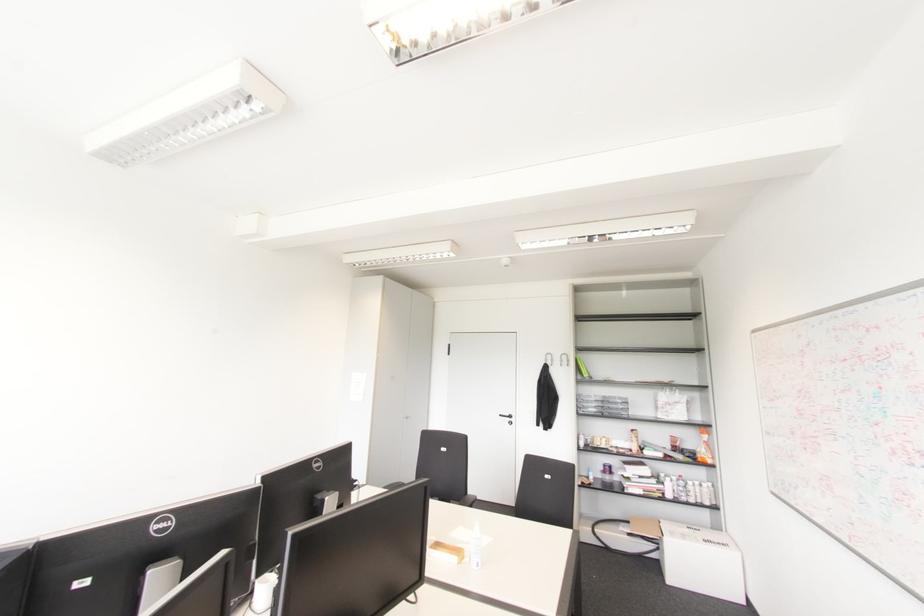
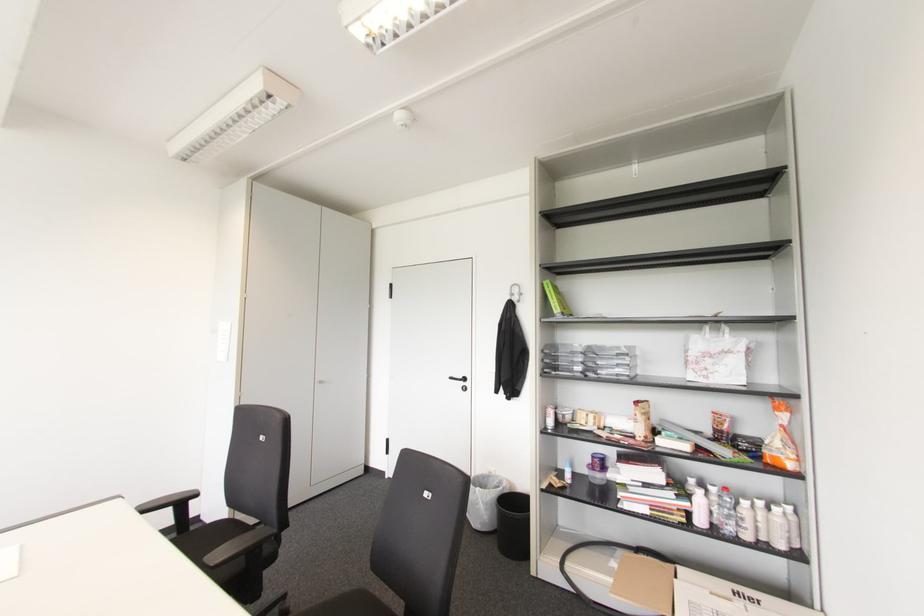
Question: I am providing you with two images of the same scene from different viewpoints. Please identify which objects are invisible in image2.

Choices:
 (A) chair sitting surface
 (B) white-capped bottle
 (C) cardboard box
 (D) none of these

Answer: (D)